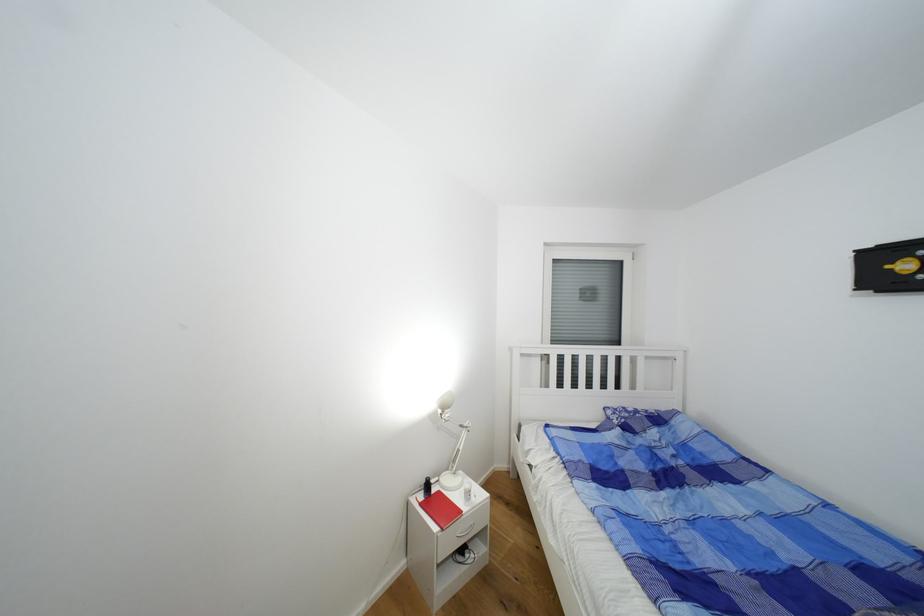
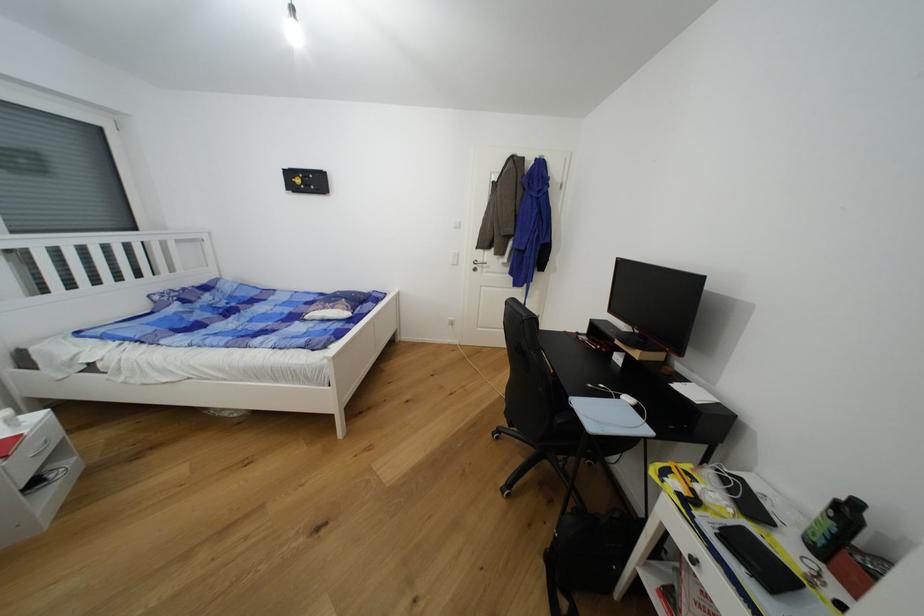
Find the pixel in the second image that matches point (614, 413) in the first image.

(162, 299)